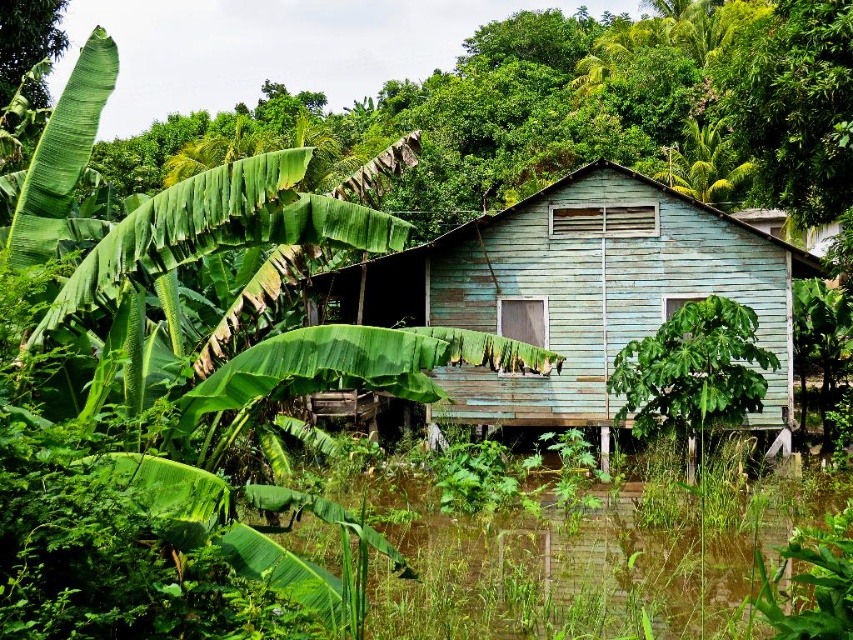
You are standing in front of the rustic wooden house and looking towards the dense vegetation. There is a point marked at coordinates (161, 384). What object is located at this point?

The point at coordinates (161, 384) is occupied by a green leafy banana tree at left.

You are standing in front of the light blue wooden hut at center and want to see the green leafy banana tree at left. Which direction should you face?

The green leafy banana tree at left is positioned over the light blue wooden hut at center, so you should face towards the left side to see it.